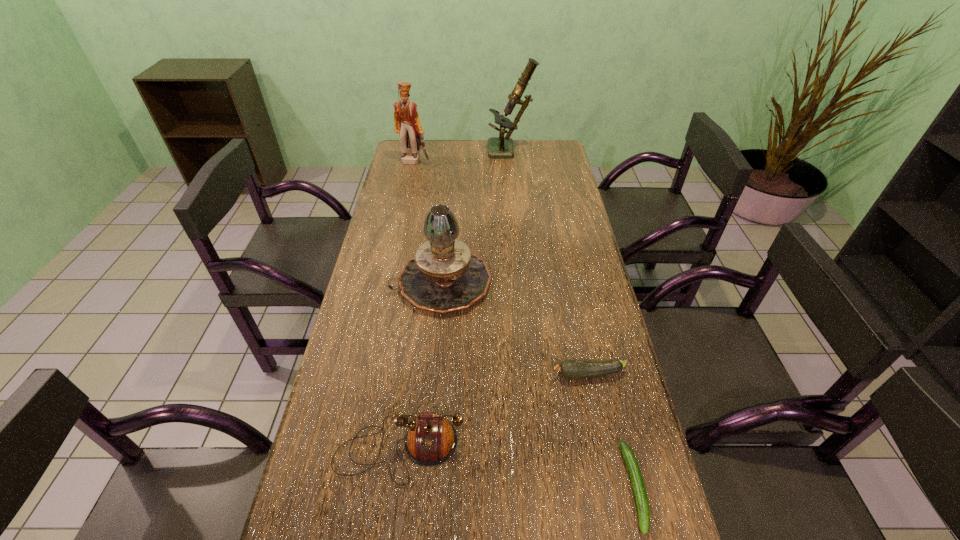
The image size is (960, 540). What are the coordinates of `nutcracker located in the left edge section of the desktop` in the screenshot? It's located at (407, 124).

I want to click on oil lamp at the left edge, so click(444, 276).

The height and width of the screenshot is (540, 960). Find the location of `telephone situated at the left edge`. telephone situated at the left edge is located at coordinates (431, 440).

The height and width of the screenshot is (540, 960). I want to click on microscope that is positioned at the right edge, so click(x=498, y=147).

Find the location of a particular element. The height and width of the screenshot is (540, 960). object present at the far left corner is located at coordinates (407, 124).

Locate an element on the screen. The image size is (960, 540). object located in the far right corner section of the desktop is located at coordinates (498, 147).

Where is `vacant space at the far edge of the desktop`? This screenshot has height=540, width=960. vacant space at the far edge of the desktop is located at coordinates (461, 156).

Identify the location of vacant area at the left edge. The image size is (960, 540). [x=405, y=232].

The image size is (960, 540). I want to click on vacant region at the right edge of the desktop, so (593, 344).

You are a GUI agent. You are given a task and a screenshot of the screen. Output one action in this format:
    pyautogui.click(x=<x>, y=<y>)
    Task: Click on the free point at the far right corner
    The image size is (960, 540).
    Given the screenshot: What is the action you would take?
    pyautogui.click(x=540, y=153)